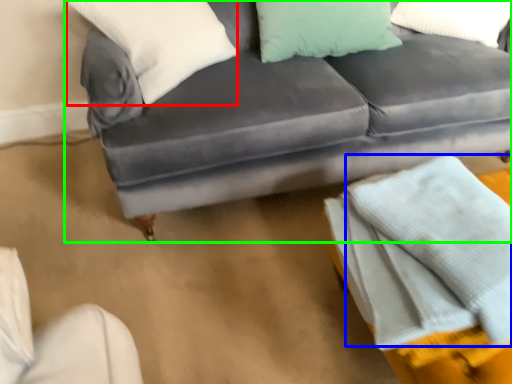
Question: Which object is positioned farthest from pillow (highlighted by a red box)? Select from blanket (highlighted by a blue box) and studio couch (highlighted by a green box).

Choices:
 (A) blanket
 (B) studio couch

Answer: (A)